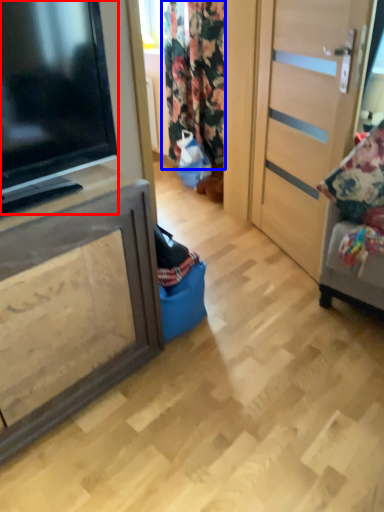
Question: Which of the following is the farthest to the observer, television (highlighted by a red box) or curtain (highlighted by a blue box)?

Choices:
 (A) television
 (B) curtain

Answer: (B)